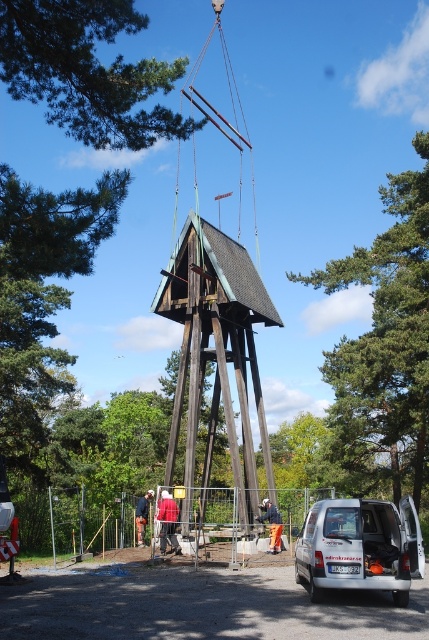
You are a delivery driver who needs to park your vehicle behind the orange fabric at center. Is the white matte van at lower right blocking your path to park there?

The white matte van at lower right is in front of the orange fabric at center, so it is blocking the path to park behind the orange fabric at center.

You are standing at the camera position and want to take a photo of the dark brown wooden bell tower at center. If your camera has a maximum zoom range of 50 feet, will you be able to capture the entire bell tower without moving closer?

The dark brown wooden bell tower at center is 65.89 feet away from the camera, which exceeds the maximum zoom range of 50 feet. Therefore, you will not be able to capture the entire bell tower without moving closer.